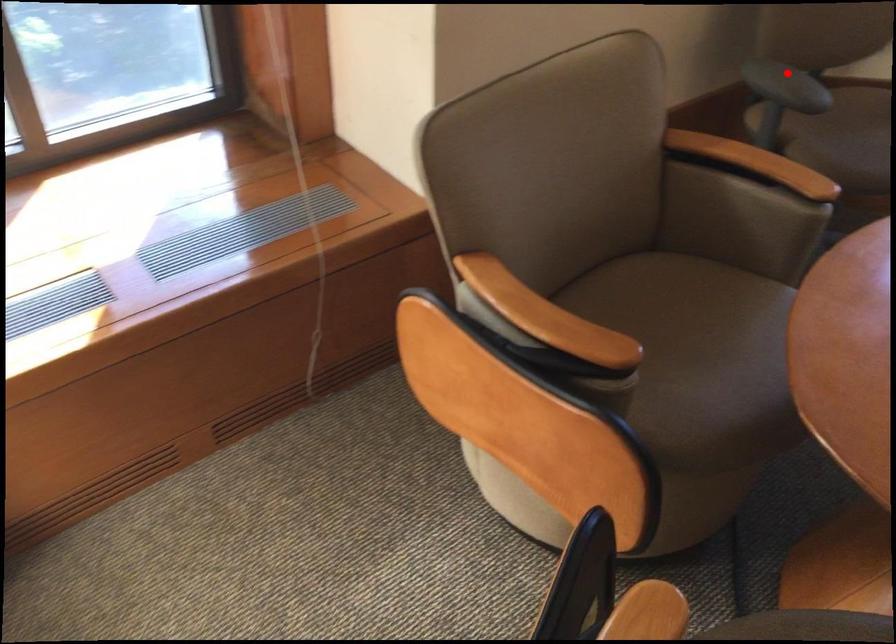
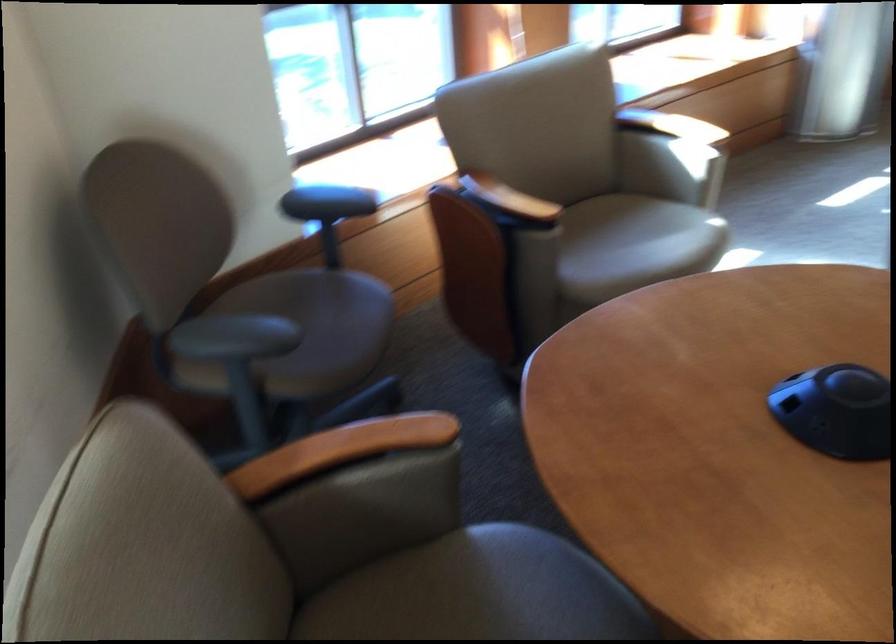
Locate, in the second image, the point that corresponds to the highlighted location in the first image.

(234, 337)